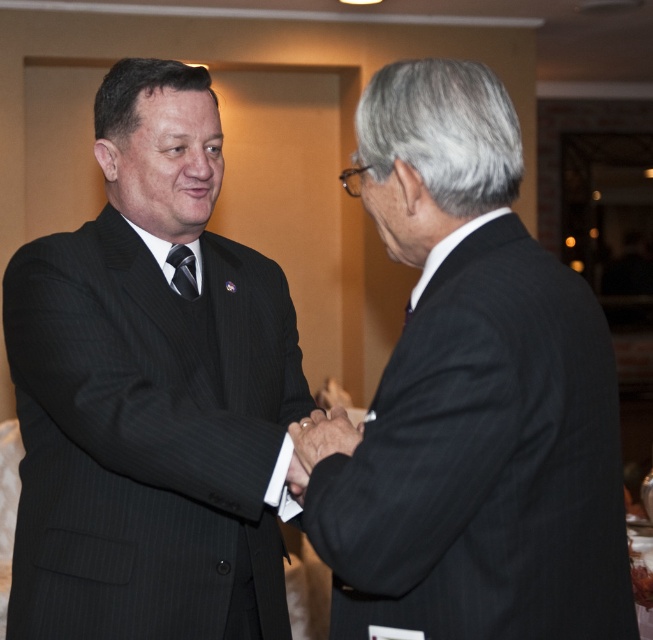
Based on the scene description, where exactly is the black pinstripe suit at right located?

The black pinstripe suit at right is located at point [473,396].

You are standing in the middle of the image. The black pinstripe suit at right is located at coordinates point (473, 396). Can you determine if the point is to the left or right of the black pinstripe suit at right?

The point (473, 396) corresponds to the black pinstripe suit at right, so the point is exactly at the location of the black pinstripe suit at right.